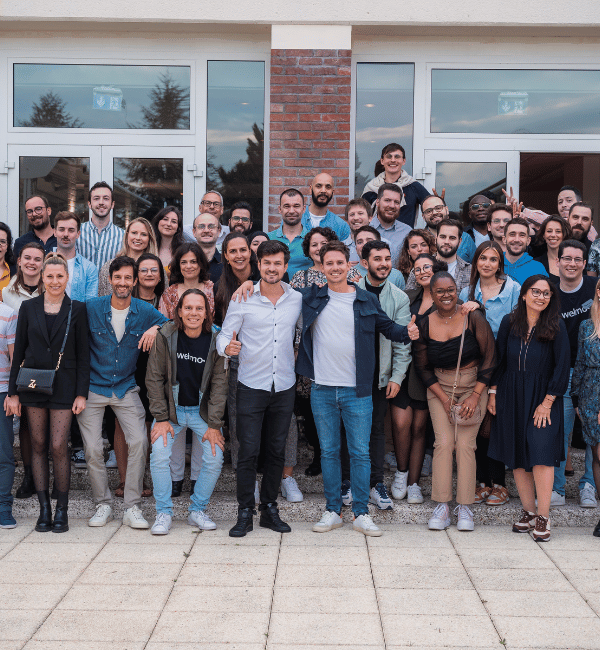
Where is `windows`? This screenshot has height=650, width=600. windows is located at coordinates (169, 104), (221, 114), (399, 99), (452, 101), (462, 171), (167, 171), (68, 162).